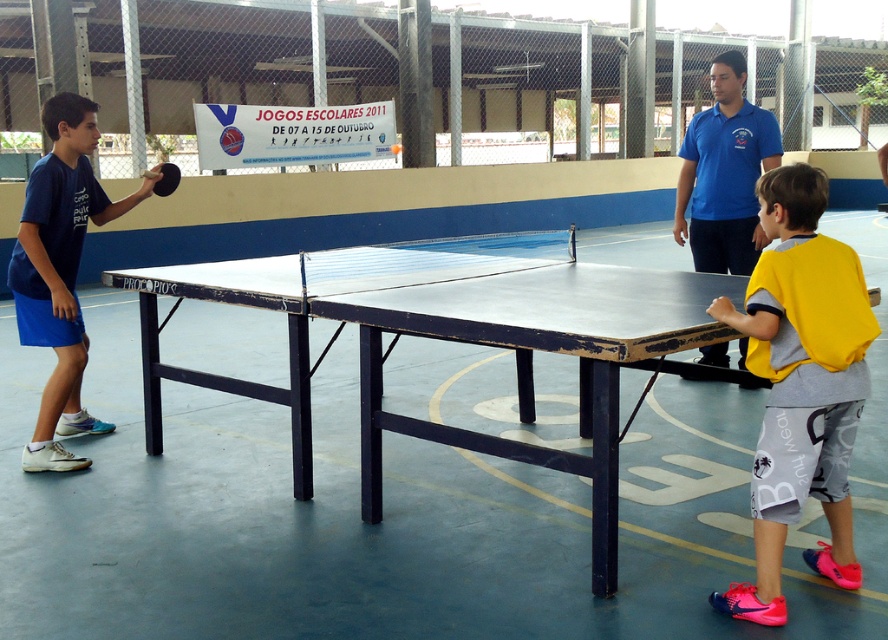
Question: Can you confirm if blue cotton shirt at center is positioned to the right of black rubber table tennis table at center?

Choices:
 (A) yes
 (B) no

Answer: (A)

Question: Which object appears closest to the camera in this image?

Choices:
 (A) black rubber table tennis table at center
 (B) blue cotton shirt at center
 (C) matte blue shorts at left
 (D) yellow jersey at right

Answer: (D)

Question: Which is farther from the blue cotton shirt at center?

Choices:
 (A) black rubber table tennis table at center
 (B) yellow jersey at right
 (C) matte blue shorts at left

Answer: (C)

Question: Which point is farther to the camera?

Choices:
 (A) blue cotton shirt at center
 (B) black rubber table tennis table at center

Answer: (A)

Question: Does yellow jersey at right have a greater width compared to black rubber table tennis table at center?

Choices:
 (A) yes
 (B) no

Answer: (A)

Question: Can you confirm if yellow jersey at right is thinner than black rubber table tennis table at center?

Choices:
 (A) no
 (B) yes

Answer: (A)